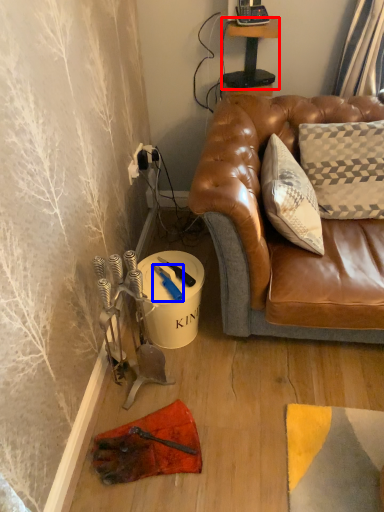
Question: Among these objects, which one is nearest to the camera, table (highlighted by a red box) or tool (highlighted by a blue box)?

Choices:
 (A) table
 (B) tool

Answer: (B)